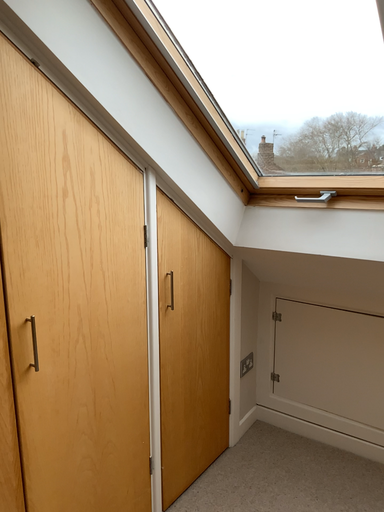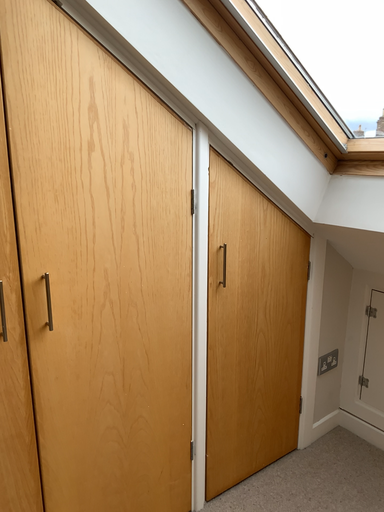
Question: How did the camera likely rotate when shooting the video?

Choices:
 (A) rotated right
 (B) rotated left

Answer: (B)